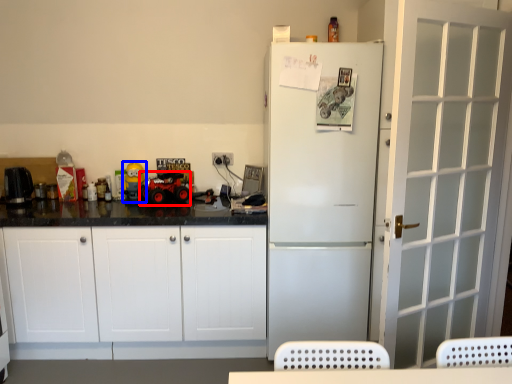
Question: Which object is further to the camera taking this photo, toy car (highlighted by a red box) or toy (highlighted by a blue box)?

Choices:
 (A) toy car
 (B) toy

Answer: (B)